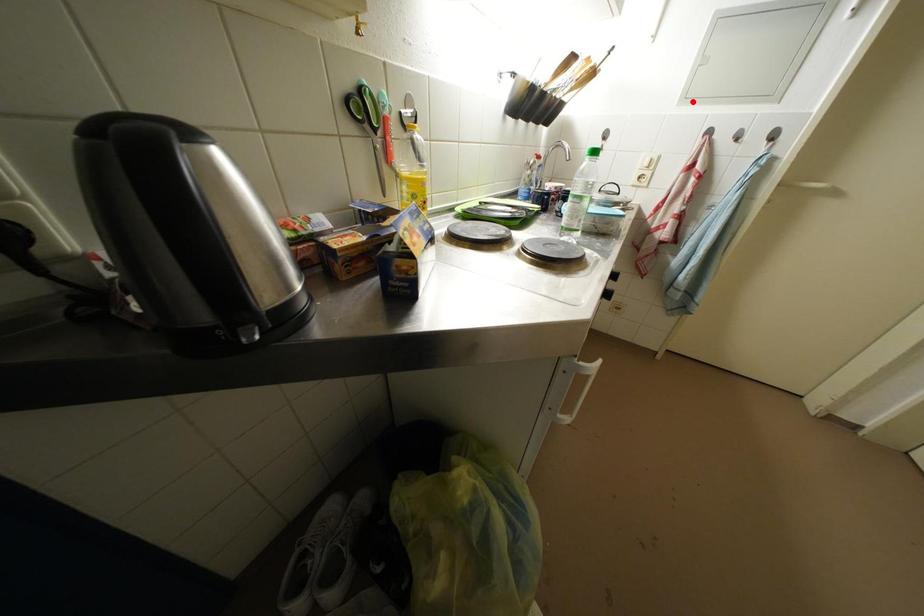
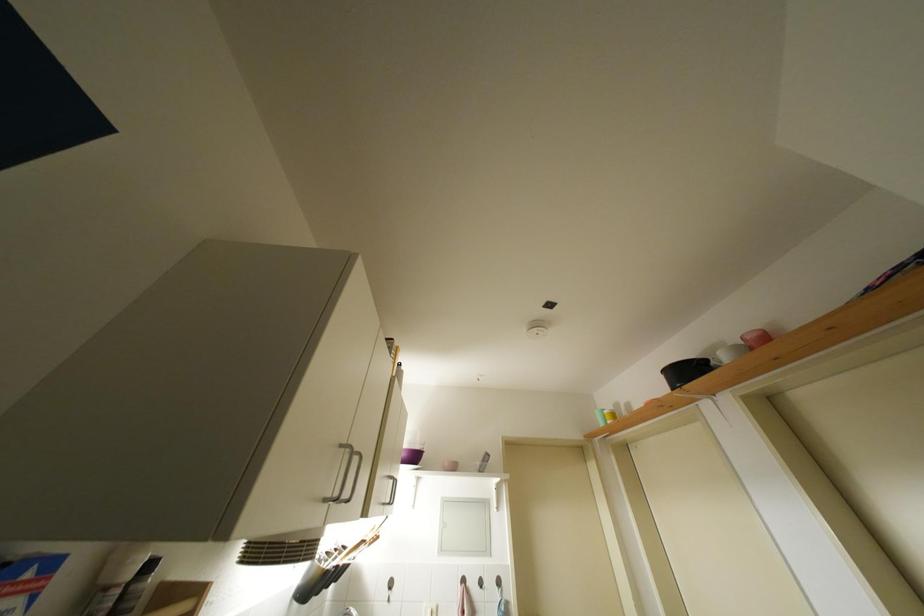
Where in the second image is the point corresponding to the highlighted location from the first image?

(447, 554)